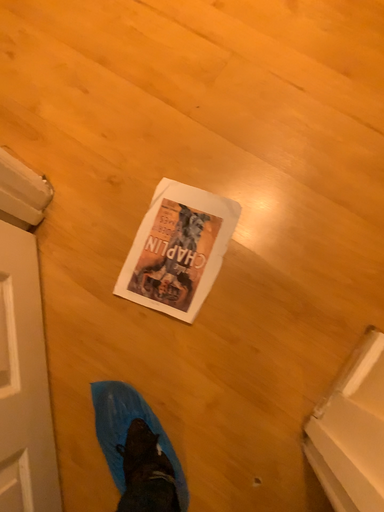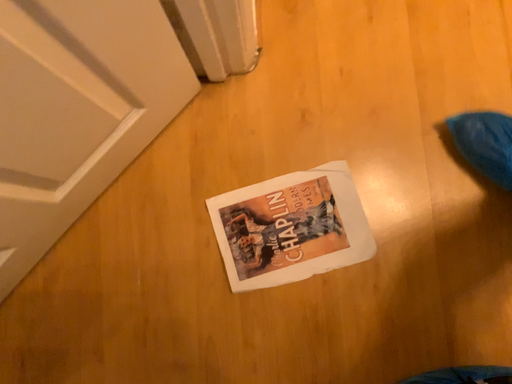
Question: How did the camera likely rotate when shooting the video?

Choices:
 (A) rotated right
 (B) rotated left

Answer: (B)